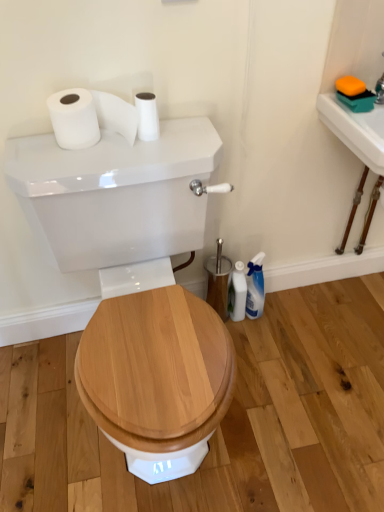
Question: In the image, is white glossy toilet brush at lower right on the left side or the right side of white matte toilet paper at upper center, which is counted as the second toilet paper, starting from the left?

Choices:
 (A) left
 (B) right

Answer: (B)

Question: From a real-world perspective, is white glossy toilet brush at lower right physically located above or below white matte toilet paper at upper center, the first toilet paper positioned from the right?

Choices:
 (A) below
 (B) above

Answer: (A)

Question: Which object is positioned farthest from the white glossy toilet tank at center?

Choices:
 (A) white glossy toilet brush at lower right
 (B) white matte toilet paper at upper center, the first toilet paper positioned from the right
 (C) white glossy sink at upper right
 (D) white matte toilet paper at upper left, which appears as the first toilet paper when viewed from the left

Answer: (C)

Question: Which is nearer to the white matte toilet paper at upper center, the first toilet paper positioned from the right?

Choices:
 (A) white glossy toilet brush at lower right
 (B) white glossy sink at upper right
 (C) white glossy toilet tank at center
 (D) white matte toilet paper at upper left, which is the 2th toilet paper from right to left

Answer: (D)